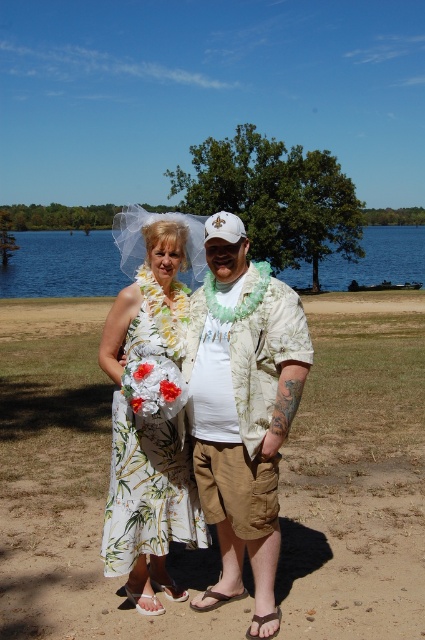
You are a photographer trying to capture a clear shot of both the hawaiian print shirt at center and the white floral dress at center. Which one is covering the other in the image?

The hawaiian print shirt at center is positioned over the white floral dress at center, so it is covering the dress.

Based on the photo, you are a photographer standing in front of the two people in the scene. You want to take a photo that includes both the hawaiian print shirt at center and the blue water at center. Which object should you focus on first to ensure both are in focus?

The hawaiian print shirt at center is closer to the viewer than the blue water at center, so you should focus on the hawaiian print shirt at center first to ensure both are in focus.

You are a photographer trying to capture the perfect shot of the hawaiian print shirt at center. Based on the coordinates provided in the scene description, where should you position your camera to ensure the shirt is centered in your frame?

The hawaiian print shirt at center is located at point (243, 410), so positioning the camera to align the center of the frame with these coordinates will ensure the shirt is centered in the shot.